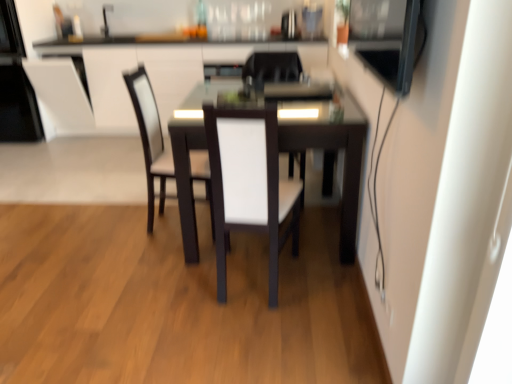
The image size is (512, 384). Identify the location of vacant space situated on the left part of dark wood table at center. (111, 242).